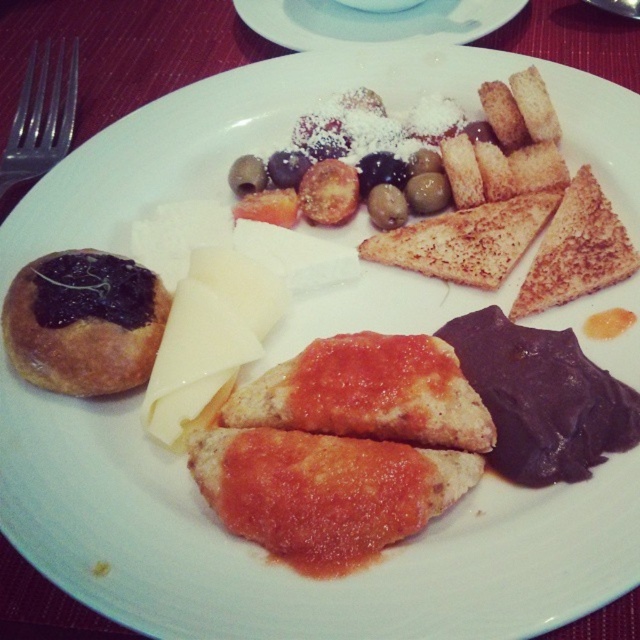
You are a food photographer setting up a shot of the plate. The white creamy cheese at center must be in focus. Given that your camera can only focus on objects within 36 inches, will you need to adjust the camera position to capture the cheese properly?

The white creamy cheese at center is 37.78 inches from the camera, which is beyond the camera focus range of 36 inches. Therefore, you need to move the camera closer to the plate to ensure the white creamy cheese at center is within the focus range.

You are standing in front of the plate of food. There is a point marked at coordinates point (x=221, y=342). If you want to reach this point with a spoon that is 2.5 feet long, will the spoon be long enough to reach it?

The point (x=221, y=342) is 3.30 feet away from the viewer. Since the spoon is only 2.5 feet long, it will not be long enough to reach the point.